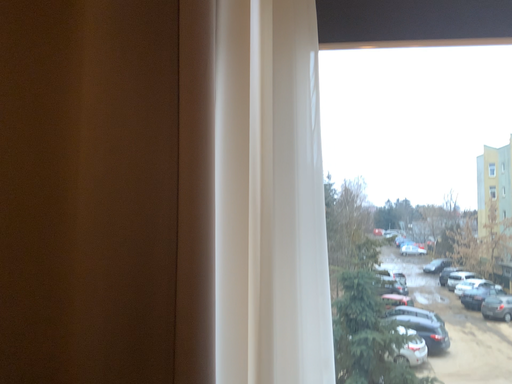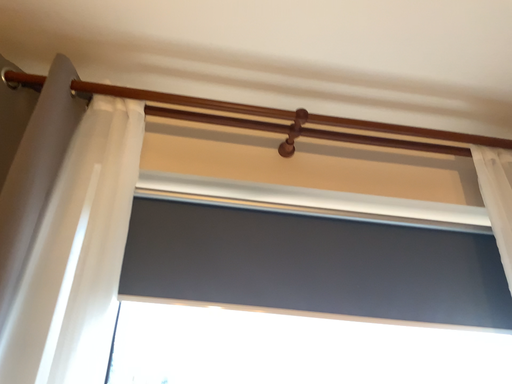
Question: How did the camera likely rotate when shooting the video?

Choices:
 (A) rotated downward
 (B) rotated upward

Answer: (B)